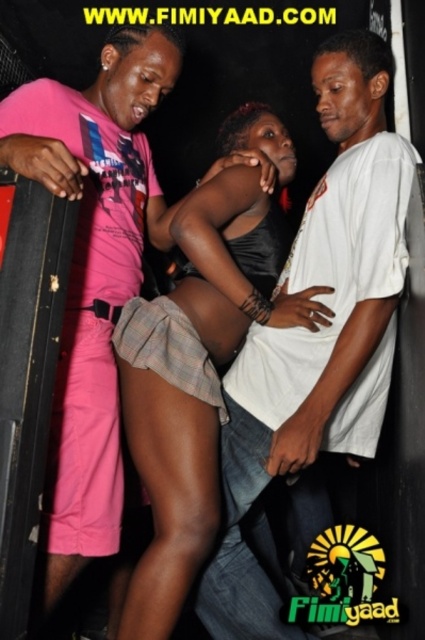
You are a photographer at a fashion show. You need to capture a closeup shot of the white cotton shirt at center and the black satin dress at center. The minimum distance required for your camera lens to focus properly is 25 centimeters. Based on the scene description, will you be able to focus on both items simultaneously?

The white cotton shirt at center and black satin dress at center are 24.36 centimeters apart from each other. Since the minimum focusing distance required is 25 centimeters, the distance between them is too short. Therefore, the camera lens cannot focus on both items simultaneously.

Looking at this image, you are at point (418, 154) and want to reach point (102, 305). Is there a clear path between them?

Yes, since point (418, 154) is in front of point (102, 305), there is a clear path between them.